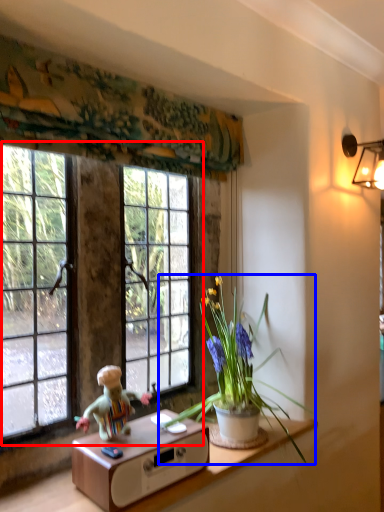
Question: Which point is closer to the camera, window (highlighted by a red box) or houseplant (highlighted by a blue box)?

Choices:
 (A) window
 (B) houseplant

Answer: (B)